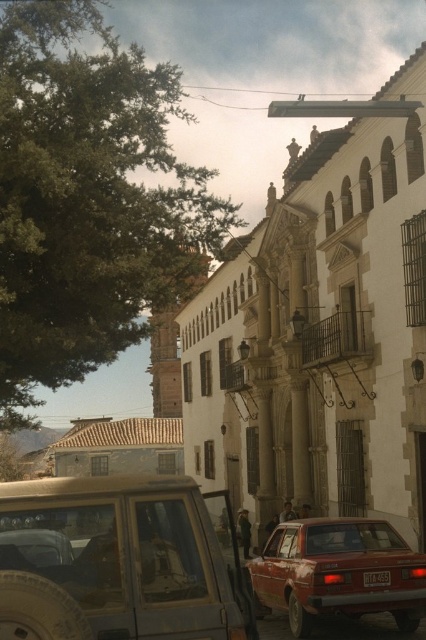
Who is taller, metallic silver suv at center or metallic red license plate at center?

metallic silver suv at center is taller.

Does metallic silver suv at center come behind metallic red license plate at center?

That is False.

Describe the element at coordinates (117, 561) in the screenshot. I see `metallic silver suv at center` at that location.

Locate an element on the screen. metallic silver suv at center is located at coordinates (117, 561).

Can you confirm if metallic silver suv at center is taller than matte red sedan at lower right?

Correct, metallic silver suv at center is much taller as matte red sedan at lower right.

At what (x,y) coordinates should I click in order to perform the action: click on metallic silver suv at center. Please return your answer as a coordinate pair (x, y). The height and width of the screenshot is (640, 426). Looking at the image, I should click on (117, 561).

Which is behind, point (161, 577) or point (344, 612)?

Positioned behind is point (344, 612).

Locate an element on the screen. metallic silver suv at center is located at coordinates tap(117, 561).

Is point (400, 552) positioned before point (380, 586)?

No, (400, 552) is further to viewer.

Does matte red sedan at lower right lie in front of metallic red license plate at center?

Yes, it is.

Locate an element on the screen. matte red sedan at lower right is located at coordinates tap(336, 572).

You are a GUI agent. You are given a task and a screenshot of the screen. Output one action in this format:
    pyautogui.click(x=<x>, y=<y>)
    Task: Click on the matte red sedan at lower right
    
    Given the screenshot: What is the action you would take?
    pyautogui.click(x=336, y=572)